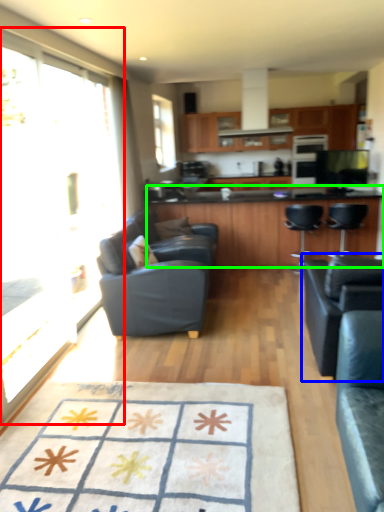
Question: Considering the real-world distances, which object is closest to glass door (highlighted by a red box)? chair (highlighted by a blue box) or countertop (highlighted by a green box).

Choices:
 (A) chair
 (B) countertop

Answer: (B)